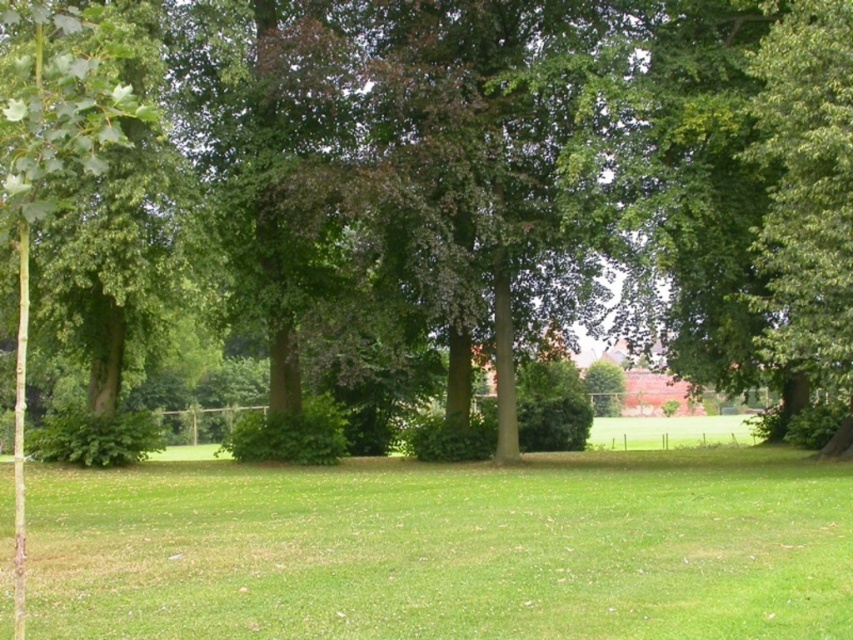
Question: Does green leafy tree at center have a lesser width compared to green grass at center?

Choices:
 (A) yes
 (B) no

Answer: (B)

Question: Can you confirm if green leafy tree at center is positioned to the left of green grass at center?

Choices:
 (A) no
 (B) yes

Answer: (A)

Question: Which point is farther to the camera?

Choices:
 (A) (805, 72)
 (B) (653, 461)

Answer: (B)

Question: Is green leafy tree at center behind green grass at center?

Choices:
 (A) yes
 (B) no

Answer: (B)